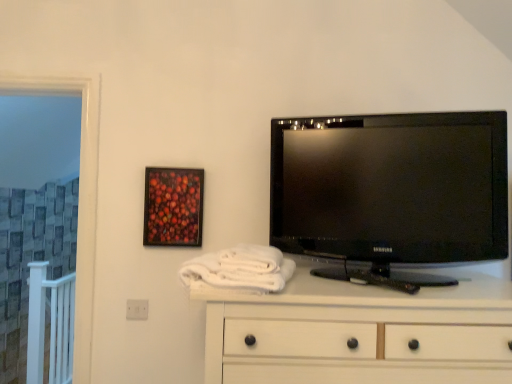
Question: From the image's perspective, relative to wooden-framed artwork at upper left, is white wood chest of drawers at lower center above or below?

Choices:
 (A) below
 (B) above

Answer: (A)

Question: In terms of width, does white wood chest of drawers at lower center look wider or thinner when compared to wooden-framed artwork at upper left?

Choices:
 (A) wide
 (B) thin

Answer: (A)

Question: Based on their relative distances, which object is nearer to the black glossy tv at upper right?

Choices:
 (A) wooden-framed artwork at upper left
 (B) white soft towel at center
 (C) white wood chest of drawers at lower center

Answer: (C)

Question: Which is nearer to the white wood chest of drawers at lower center?

Choices:
 (A) white soft towel at center
 (B) wooden-framed artwork at upper left
 (C) black glossy tv at upper right

Answer: (A)